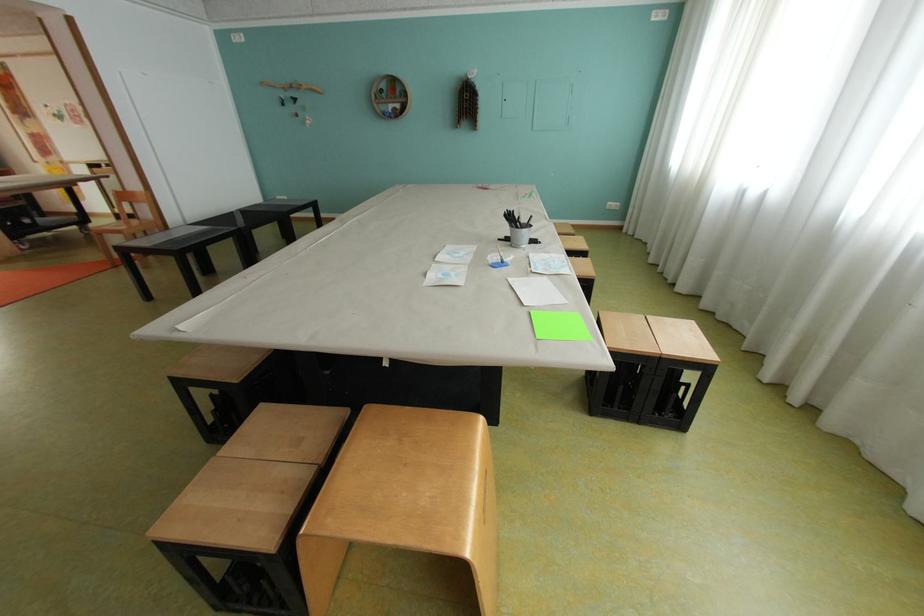
You are a GUI agent. You are given a task and a screenshot of the screen. Output one action in this format:
    pyautogui.click(x=<x>, y=<y>)
    Task: Click on the chair sitting surface
    Image resolution: width=924 pixels, height=616 pixels.
    Given the screenshot: What is the action you would take?
    pyautogui.click(x=261, y=436)